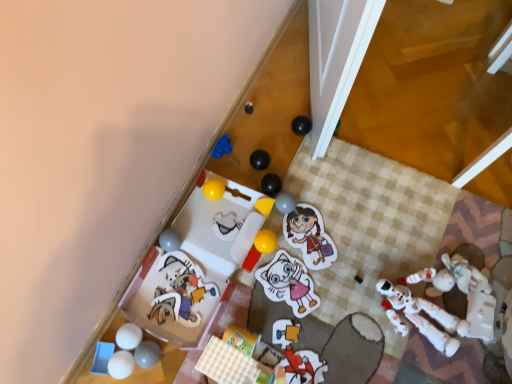
What are the coordinates of `free space to the left of white matte cat at center, placed as the fourteenth toy when sorted from left to right` in the screenshot? It's located at (230, 282).